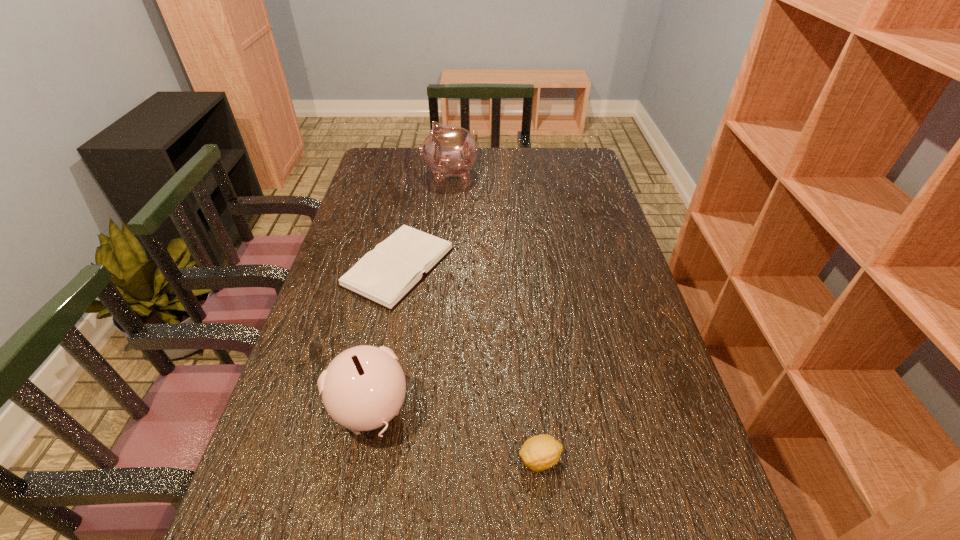
At what (x,y) coordinates should I click in order to perform the action: click on the tallest object. Please return your answer as a coordinate pair (x, y). Looking at the image, I should click on (449, 151).

This screenshot has width=960, height=540. In order to click on the farther piggy bank in this screenshot , I will do `click(449, 151)`.

This screenshot has height=540, width=960. What are the coordinates of `the shorter piggy bank` in the screenshot? It's located at (363, 388).

The width and height of the screenshot is (960, 540). I want to click on the nearer piggy bank, so click(363, 388).

Identify the location of the third tallest object. (540, 452).

What are the coordinates of `lemon` in the screenshot? It's located at (540, 452).

Find the location of `hardback book`. hardback book is located at coordinates (385, 275).

Find the location of a particular element. Image resolution: width=960 pixels, height=540 pixels. the second farthest object is located at coordinates [385, 275].

The height and width of the screenshot is (540, 960). Find the location of `vacant space located on the front facing side of the tallest object`. vacant space located on the front facing side of the tallest object is located at coordinates (384, 174).

I want to click on vacant space located 0.200m on the front facing side of the tallest object, so click(x=368, y=174).